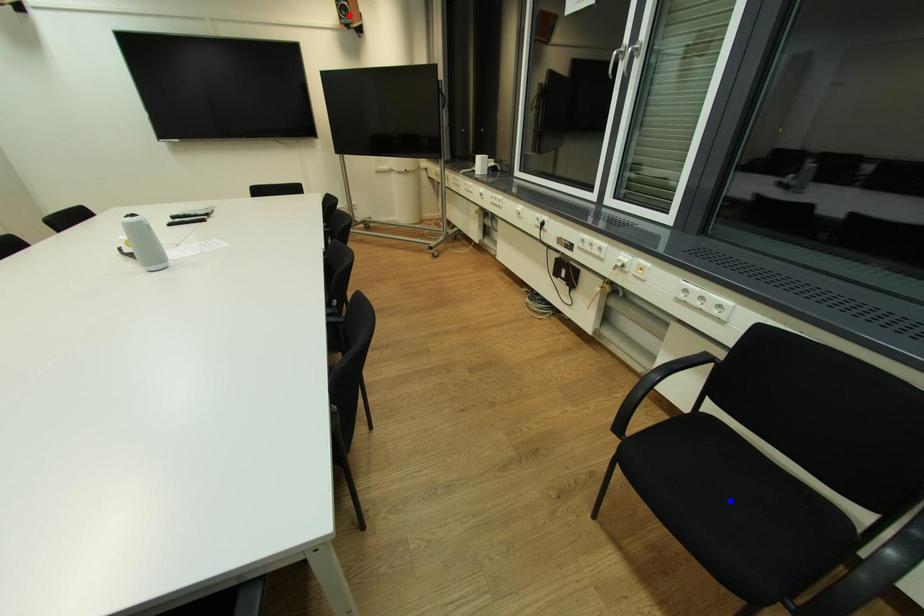
Question: In the image, two points are highlighted. Which point is nearer to the camera? Reply with the corresponding letter.

Choices:
 (A) blue point
 (B) red point

Answer: (A)